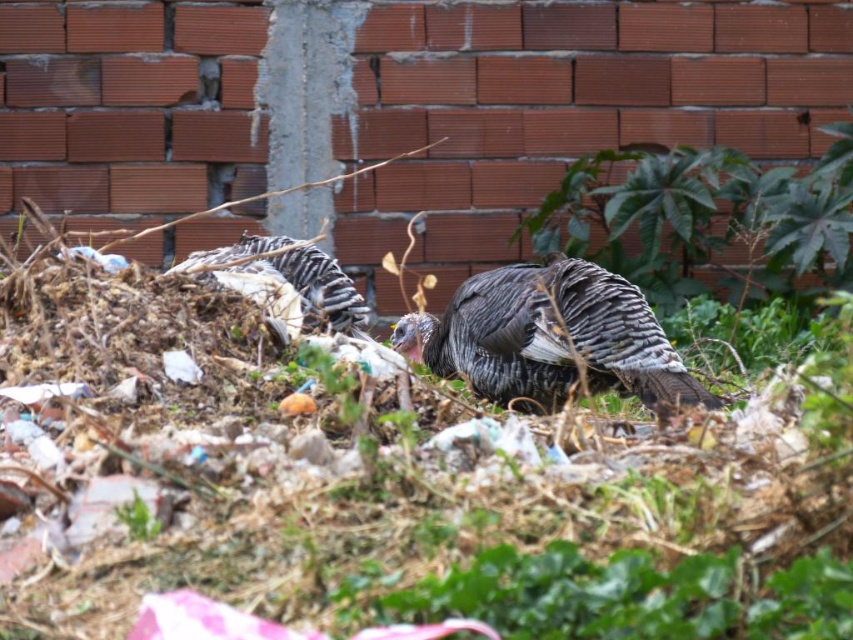
Consider the image. You are a photographer trying to capture both the gray matte turkey at center and the speckled feathered turkey at center. Since you want to ensure both are in focus, which turkey should you focus on first to account for their positions?

The gray matte turkey at center is positioned under the speckled feathered turkey at center. To ensure both are in focus, you should focus on the gray matte turkey at center first as it is closer to the camera.

You are a wildlife photographer trying to capture both the gray matte turkey at center and the speckled feathered turkey at center in a single frame. Which turkey should you focus on first to ensure both are in the frame?

The gray matte turkey at center is much taller than the speckled feathered turkey at center, so you should focus on the gray matte turkey at center first to ensure both are in the frame.

You are a wildlife photographer aiming to capture both the gray matte turkey at center and the speckled feathered turkey at center in a single frame. Given that your camera has a maximum focus range of 20 inches, will you be able to focus on both turkeys simultaneously?

The gray matte turkey at center and the speckled feathered turkey at center are 23.26 inches apart, which exceeds the camera maximum focus range of 20 inches. Therefore, you cannot focus on both turkeys at the same time.